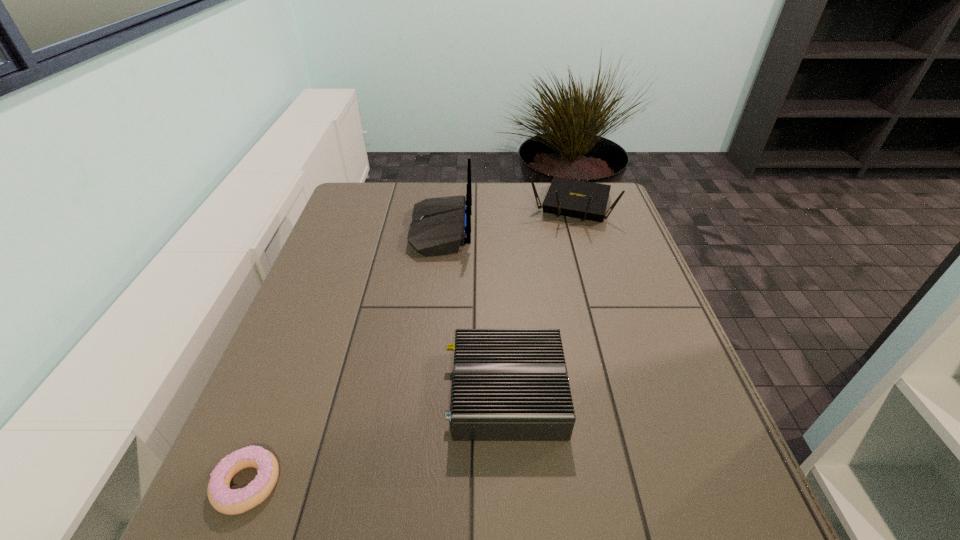
Locate an element on the screen. free point located on the back panel of the shortest router is located at coordinates (340, 393).

At what (x,y) coordinates should I click in order to perform the action: click on vacant space located on the right of the shortest object. Please return your answer as a coordinate pair (x, y). Image resolution: width=960 pixels, height=540 pixels. Looking at the image, I should click on (360, 484).

The height and width of the screenshot is (540, 960). Identify the location of object at the near edge. (223, 499).

Where is `object at the left edge`? object at the left edge is located at coordinates (223, 499).

Locate an element on the screen. object that is at the right edge is located at coordinates (585, 200).

I want to click on object present at the near left corner, so click(223, 499).

The width and height of the screenshot is (960, 540). What are the coordinates of `object located in the far right corner section of the desktop` in the screenshot? It's located at (585, 200).

In order to click on vacant space at the far edge of the desktop in this screenshot , I will do `click(529, 183)`.

Image resolution: width=960 pixels, height=540 pixels. In order to click on free space at the left edge in this screenshot , I will do `click(338, 339)`.

I want to click on free space at the right edge of the desktop, so (699, 396).